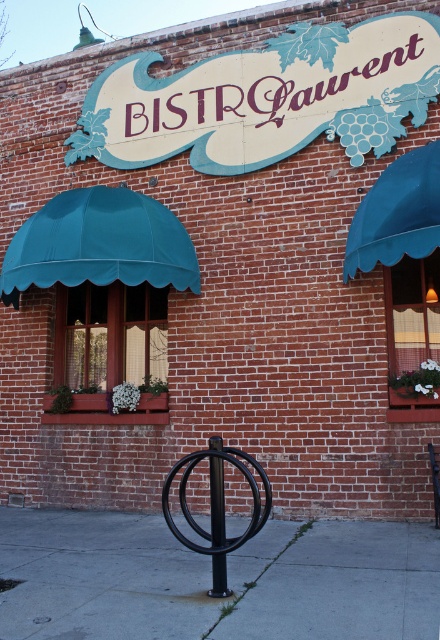
Is gray concrete sidewalk at lower center below teal fabric awning at upper right?

Yes, gray concrete sidewalk at lower center is below teal fabric awning at upper right.

Who is more forward, (286, 572) or (359, 252)?

Point (286, 572) is in front.

You are a GUI agent. You are given a task and a screenshot of the screen. Output one action in this format:
    pyautogui.click(x=<x>, y=<y>)
    Task: Click on the gray concrete sidewalk at lower center
    This screenshot has width=440, height=640.
    Given the screenshot: What is the action you would take?
    [209, 580]

Who is more forward, [223,602] or [248,83]?

Positioned in front is point [223,602].

Does point (245, 612) lie in front of point (129, 134)?

That is True.

Who is more forward, (352, 545) or (220, 81)?

Point (352, 545) is more forward.

This screenshot has height=640, width=440. What are the coordinates of `gray concrete sidewalk at lower center` in the screenshot? It's located at (209, 580).

Is matte white sign at upper center wider than teal fabric awning at upper right?

Correct, the width of matte white sign at upper center exceeds that of teal fabric awning at upper right.

Can you confirm if matte white sign at upper center is bigger than teal fabric awning at upper right?

Yes, matte white sign at upper center is bigger than teal fabric awning at upper right.

The image size is (440, 640). I want to click on matte white sign at upper center, so click(267, 97).

What are the coordinates of `matte white sign at upper center` in the screenshot? It's located at (267, 97).